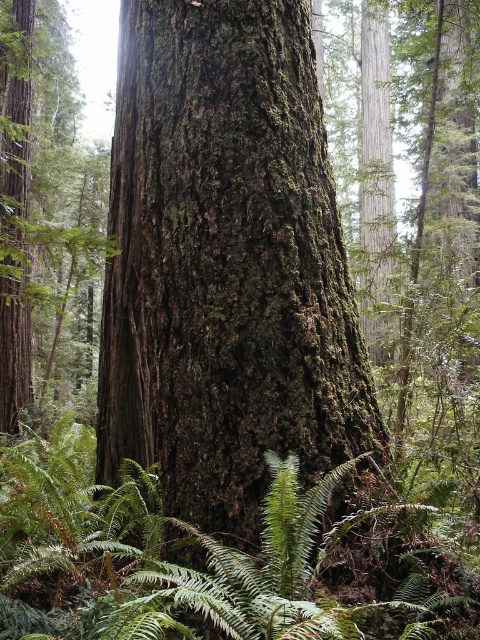
Question: Which point is closer to the camera taking this photo?

Choices:
 (A) (133, 515)
 (B) (145, 68)

Answer: (B)

Question: Where is green mossy bark at center located in relation to green leafy fern at center in the image?

Choices:
 (A) below
 (B) above

Answer: (B)

Question: Which point appears farthest from the camera in this image?

Choices:
 (A) (113, 520)
 (B) (224, 484)

Answer: (A)

Question: Can you confirm if green mossy bark at center is positioned to the right of green leafy fern at center?

Choices:
 (A) yes
 (B) no

Answer: (A)

Question: Can you confirm if green mossy bark at center is smaller than green leafy fern at center?

Choices:
 (A) yes
 (B) no

Answer: (B)

Question: Which point appears farthest from the camera in this image?

Choices:
 (A) (224, 611)
 (B) (278, 236)

Answer: (B)